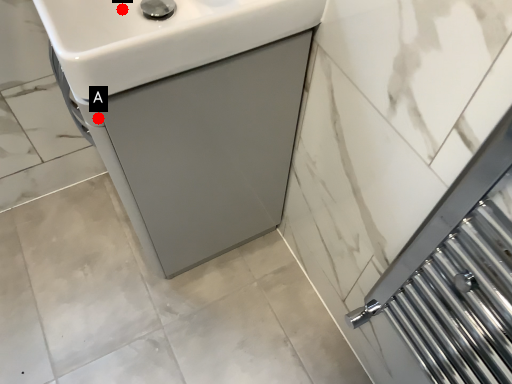
Question: Two points are circled on the image, labeled by A and B beside each circle. Which point is farther from the camera taking this photo?

Choices:
 (A) A is further
 (B) B is further

Answer: (B)